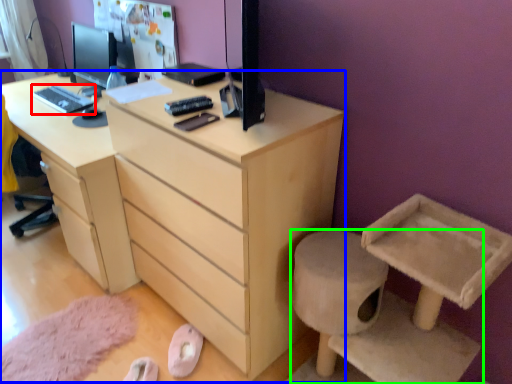
Question: Based on their relative distances, which object is farther from desktop (highlighted by a red box)? Choose from chest of drawers (highlighted by a blue box) and furniture (highlighted by a green box).

Choices:
 (A) chest of drawers
 (B) furniture

Answer: (B)